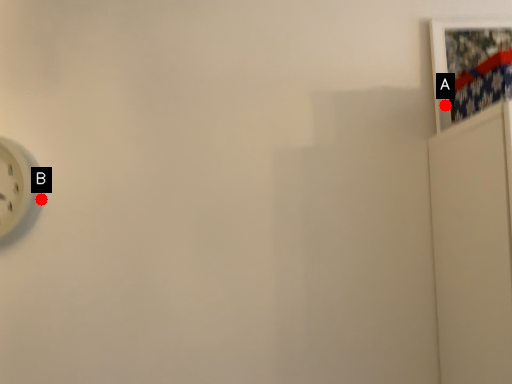
Question: Two points are circled on the image, labeled by A and B beside each circle. Which point is closer to the camera?

Choices:
 (A) A is closer
 (B) B is closer

Answer: (A)